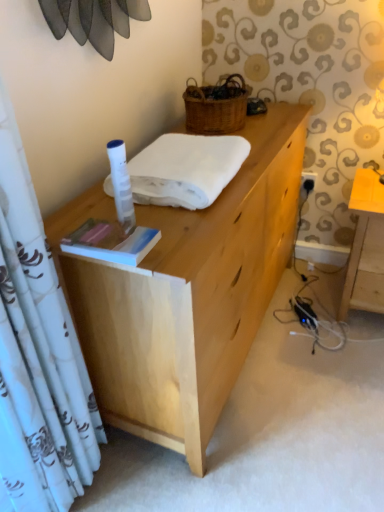
Question: Does hardcover book at center appear on the right side of white soft towel at center?

Choices:
 (A) no
 (B) yes

Answer: (A)

Question: Would you say white soft towel at center is part of hardcover book at center's contents?

Choices:
 (A) no
 (B) yes

Answer: (A)

Question: Can we say hardcover book at center lies outside white soft towel at center?

Choices:
 (A) yes
 (B) no

Answer: (A)

Question: Is hardcover book at center placed right next to white soft towel at center?

Choices:
 (A) yes
 (B) no

Answer: (B)

Question: From the image's perspective, is hardcover book at center over white soft towel at center?

Choices:
 (A) yes
 (B) no

Answer: (B)

Question: Looking at the image, does white soft towel at center seem bigger or smaller compared to hardcover book at center?

Choices:
 (A) big
 (B) small

Answer: (A)

Question: Is point (150, 196) closer or farther from the camera than point (107, 236)?

Choices:
 (A) closer
 (B) farther

Answer: (B)

Question: From the image's perspective, is white soft towel at center positioned above or below hardcover book at center?

Choices:
 (A) above
 (B) below

Answer: (A)

Question: Which is correct: white soft towel at center is inside hardcover book at center, or outside of it?

Choices:
 (A) outside
 (B) inside

Answer: (A)

Question: In terms of width, does white soft towel at center look wider or thinner when compared to white plastic power outlet at lower right?

Choices:
 (A) wide
 (B) thin

Answer: (A)

Question: Considering the positions of white soft towel at center and white plastic power outlet at lower right in the image, is white soft towel at center taller or shorter than white plastic power outlet at lower right?

Choices:
 (A) tall
 (B) short

Answer: (A)

Question: Is point (193, 185) positioned closer to the camera than point (304, 182)?

Choices:
 (A) closer
 (B) farther

Answer: (A)

Question: Would you say white soft towel at center is to the left or to the right of white plastic power outlet at lower right in the picture?

Choices:
 (A) right
 (B) left

Answer: (B)

Question: Is hardcover book at center to the left or to the right of white soft towel at center in the image?

Choices:
 (A) right
 (B) left

Answer: (B)

Question: Considering the positions of hardcover book at center and white soft towel at center in the image, is hardcover book at center wider or thinner than white soft towel at center?

Choices:
 (A) wide
 (B) thin

Answer: (B)